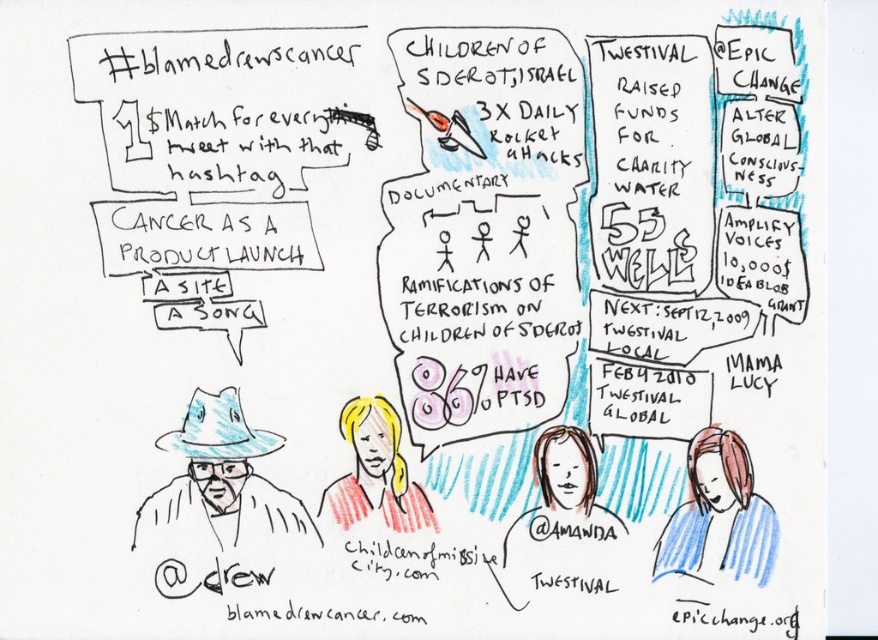
Question: Is smooth skin portrait at center positioned in front of blonde hair at lower right?

Choices:
 (A) no
 (B) yes

Answer: (A)

Question: Considering the relative positions of blonde hair at lower right and blonde hair at center in the image provided, where is blonde hair at lower right located with respect to blonde hair at center?

Choices:
 (A) left
 (B) right

Answer: (B)

Question: Which object is farther from the camera taking this photo?

Choices:
 (A) blonde hair at lower right
 (B) blue paper hat at left
 (C) blonde hair at center
 (D) smooth skin portrait at center

Answer: (C)

Question: Among these objects, which one is nearest to the camera?

Choices:
 (A) blue paper hat at left
 (B) blonde hair at center
 (C) smooth skin portrait at center
 (D) blonde hair at lower right

Answer: (D)

Question: Is blonde hair at lower right behind blonde hair at center?

Choices:
 (A) yes
 (B) no

Answer: (B)

Question: Which point appears farthest from the camera in this image?

Choices:
 (A) (553, 548)
 (B) (263, 525)
 (C) (349, 477)
 (D) (699, 493)

Answer: (C)